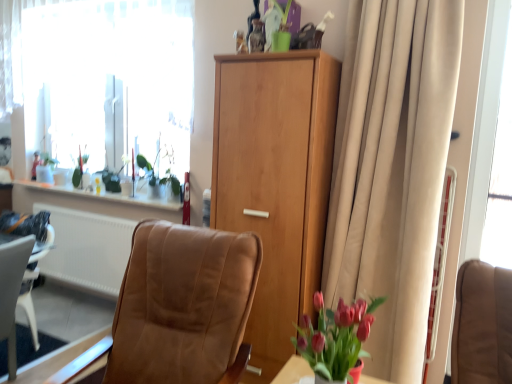
The width and height of the screenshot is (512, 384). Find the location of `empty space that is ontop of white matte radiator at lower left (from a real-world perspective)`. empty space that is ontop of white matte radiator at lower left (from a real-world perspective) is located at coordinates (94, 207).